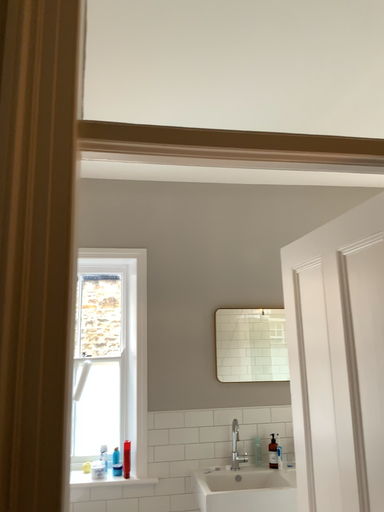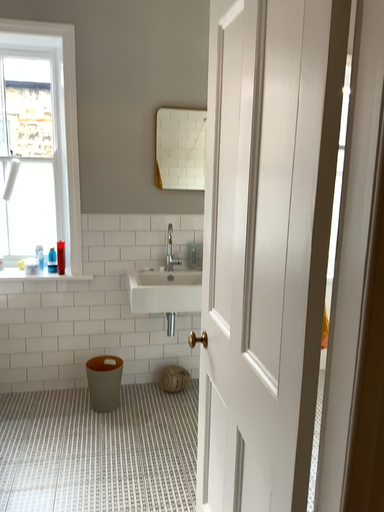
Question: Which way did the camera rotate in the video?

Choices:
 (A) rotated downward
 (B) rotated upward

Answer: (A)